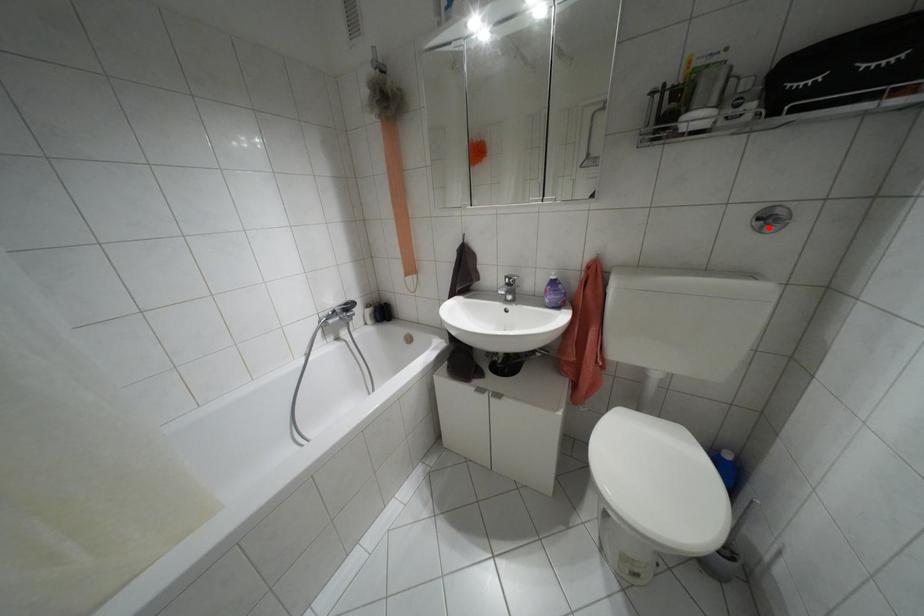
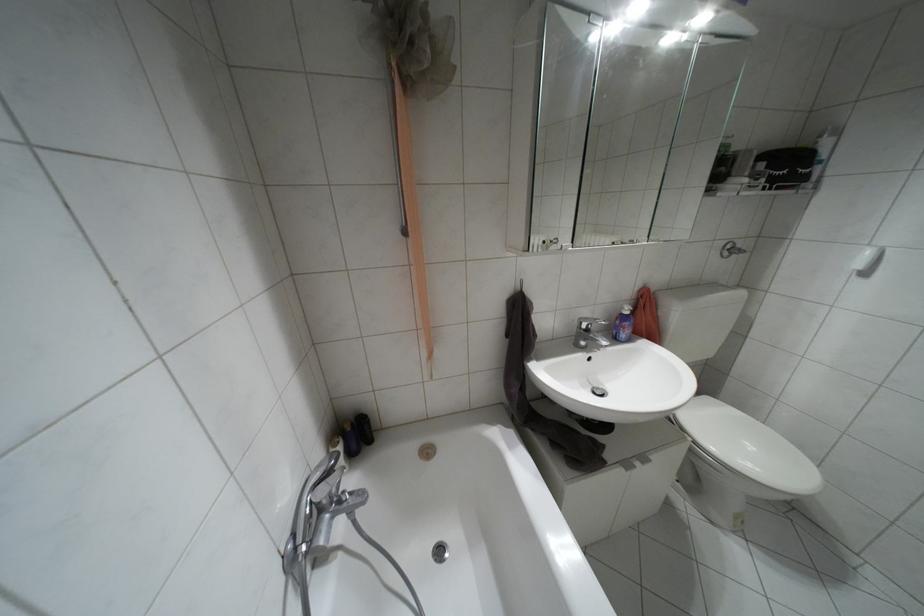
In the second image, find the point that corresponds to the highlighted location in the first image.

(723, 254)